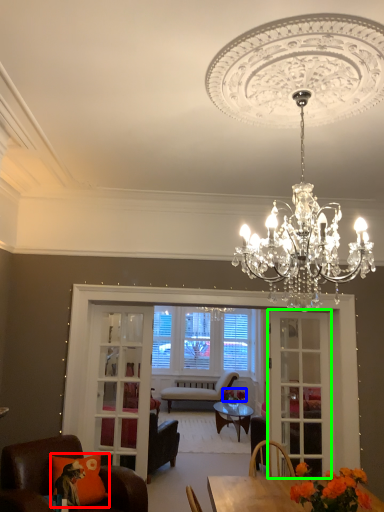
Question: Which is nearer to the pillow (highlighted by a red box)? flower (highlighted by a blue box) or screen door (highlighted by a green box).

Choices:
 (A) flower
 (B) screen door

Answer: (B)